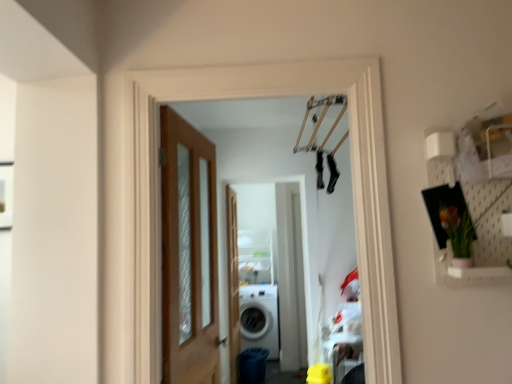
At what (x,y) coordinates should I click in order to perform the action: click on white glossy washing machine at center. Please return your answer as a coordinate pair (x, y). Looking at the image, I should click on coord(259,318).

This screenshot has height=384, width=512. I want to click on clear wood screen door at center, so click(233, 281).

What are the coordinates of `white glossy washing machine at center` in the screenshot? It's located at (259, 318).

What's the angular difference between white glossy washing machine at center and wooden door at left's facing directions?

The angular difference between white glossy washing machine at center and wooden door at left is 83.7 degrees.

Which is nearer, (248, 342) or (197, 134)?

→ The point (197, 134) is closer.

Is white glossy washing machine at center positioned far away from wooden door at left?

Yes.

From the image's perspective, does wooden door at left appear higher than clear wood screen door at center?

Yes, from the image's perspective, wooden door at left is over clear wood screen door at center.

Which object is closer to the camera taking this photo, wooden door at left or clear wood screen door at center?

Positioned in front is wooden door at left.

In the image, there is a wooden door at left. Where is `screen door below it (from a real-world perspective)`? Image resolution: width=512 pixels, height=384 pixels. screen door below it (from a real-world perspective) is located at coordinates (233, 281).

Who is taller, wooden door at left or clear wood screen door at center?

Standing taller between the two is clear wood screen door at center.

From the image's perspective, which is above, wooden door at left or white glossy washing machine at center?

wooden door at left is shown above in the image.

This screenshot has width=512, height=384. I want to click on door located above the white glossy washing machine at center (from a real-world perspective), so click(188, 254).

Choose the correct answer: Is wooden door at left inside white glossy washing machine at center or outside it?

wooden door at left exists outside the volume of white glossy washing machine at center.

From the image's perspective, is clear wood screen door at center above wooden door at left?

Actually, clear wood screen door at center appears below wooden door at left in the image.

Where is `door that appears above the clear wood screen door at center (from a real-world perspective)`? This screenshot has width=512, height=384. door that appears above the clear wood screen door at center (from a real-world perspective) is located at coordinates (188, 254).

Is the surface of clear wood screen door at center in direct contact with wooden door at left?

No, clear wood screen door at center is not making contact with wooden door at left.

Considering the positions of objects clear wood screen door at center and wooden door at left in the image provided, who is more to the left, clear wood screen door at center or wooden door at left?

Positioned to the left is wooden door at left.

Is point (232, 295) closer or farther from the camera than point (260, 286)?

Point (232, 295) is closer to the camera than point (260, 286).

Can you confirm if clear wood screen door at center is positioned to the left of white glossy washing machine at center?

Indeed, clear wood screen door at center is positioned on the left side of white glossy washing machine at center.

Who is smaller, clear wood screen door at center or white glossy washing machine at center?

clear wood screen door at center.

From the image's perspective, between clear wood screen door at center and white glossy washing machine at center, which one is located above?

clear wood screen door at center is shown above in the image.

Could you tell me if white glossy washing machine at center is turned towards clear wood screen door at center?

Yes, white glossy washing machine at center is turned towards clear wood screen door at center.

Is white glossy washing machine at center positioned far away from clear wood screen door at center?

white glossy washing machine at center is near clear wood screen door at center, not far away.

Considering the sizes of white glossy washing machine at center and clear wood screen door at center in the image, is white glossy washing machine at center bigger or smaller than clear wood screen door at center?

white glossy washing machine at center is bigger than clear wood screen door at center.

From a real-world perspective, which is physically above, white glossy washing machine at center or clear wood screen door at center?

In real-world perspective, clear wood screen door at center is above.

The width and height of the screenshot is (512, 384). I want to click on door above the white glossy washing machine at center (from the image's perspective), so click(x=188, y=254).

You are a GUI agent. You are given a task and a screenshot of the screen. Output one action in this format:
    pyautogui.click(x=<x>, y=<y>)
    Task: Click on the door in front of the clear wood screen door at center
    
    Given the screenshot: What is the action you would take?
    pyautogui.click(x=188, y=254)

Considering their positions, is clear wood screen door at center positioned further to white glossy washing machine at center than wooden door at left?

The object further to white glossy washing machine at center is wooden door at left.

Which object lies nearer to the anchor point wooden door at left, clear wood screen door at center or white glossy washing machine at center?

clear wood screen door at center is closer to wooden door at left.

Looking at the image, which one is located closer to wooden door at left, white glossy washing machine at center or clear wood screen door at center?

clear wood screen door at center.

Based on their spatial positions, is wooden door at left or white glossy washing machine at center further from clear wood screen door at center?

Among the two, wooden door at left is located further to clear wood screen door at center.

Which object lies nearer to the anchor point clear wood screen door at center, white glossy washing machine at center or wooden door at left?

Among the two, white glossy washing machine at center is located nearer to clear wood screen door at center.

When comparing their distances from white glossy washing machine at center, does wooden door at left or clear wood screen door at center seem further?

wooden door at left lies further to white glossy washing machine at center than the other object.

Where is `screen door between wooden door at left and white glossy washing machine at center from front to back`? This screenshot has width=512, height=384. screen door between wooden door at left and white glossy washing machine at center from front to back is located at coordinates (233, 281).